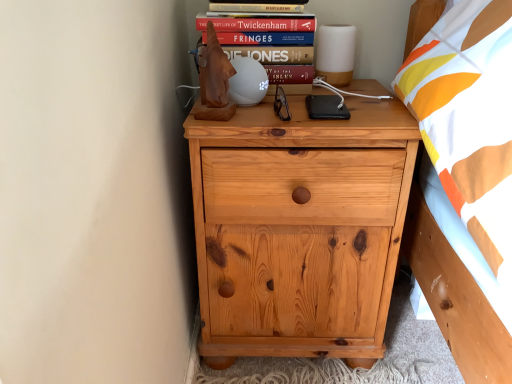
Find the location of a particular element. This screenshot has width=512, height=384. vacant region below hardcover book at upper center (from a real-world perspective) is located at coordinates coord(258,11).